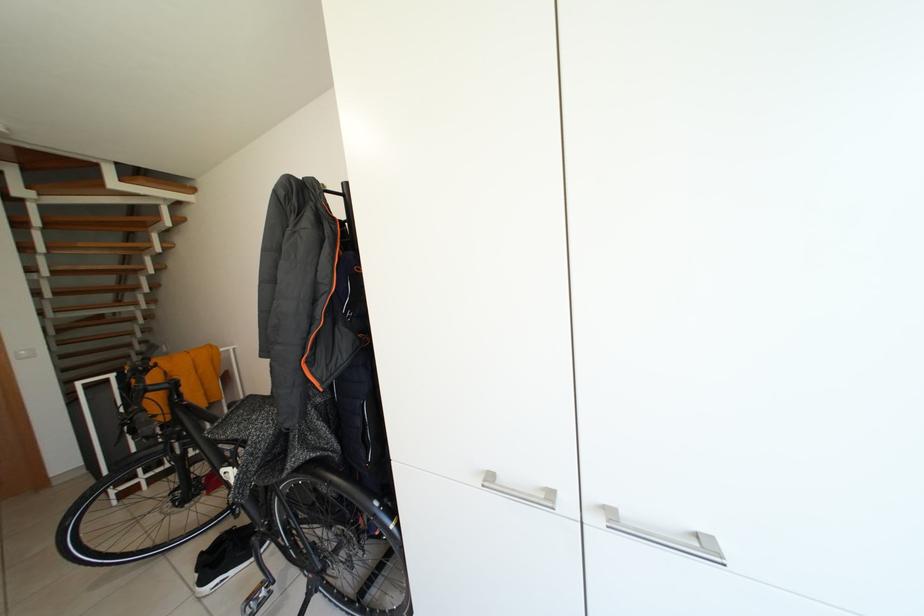
Find where to grip the bicycle handlebar grip. Please return your answer as a coordinate pair (x, y).

(225, 495)